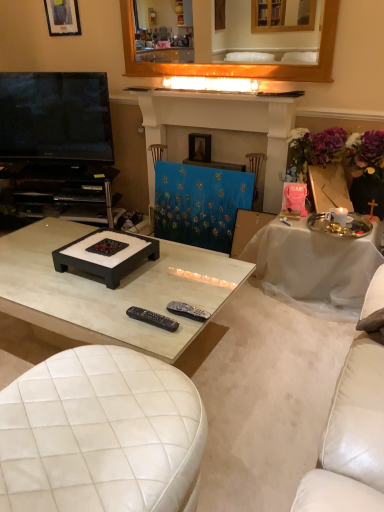
Locate an element on the screen. free point behind black plastic remote control at center, which ranks as the second remote control in right-to-left order is located at coordinates (152, 297).